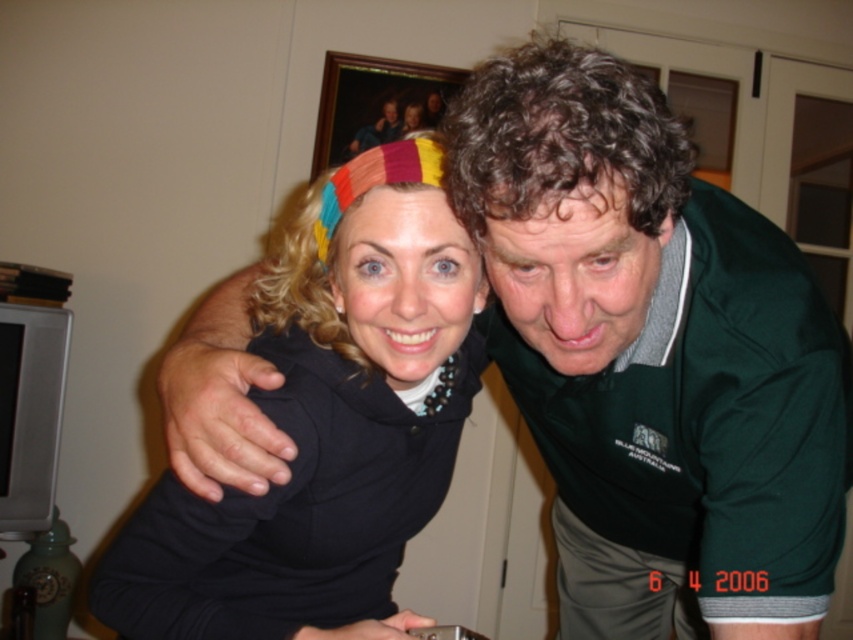
Between black matte headband at upper center and rainbow fabric headband at upper center, which one is positioned higher?

rainbow fabric headband at upper center

At what (x,y) coordinates should I click in order to perform the action: click on black matte headband at upper center. Please return your answer as a coordinate pair (x, y). Image resolution: width=853 pixels, height=640 pixels. Looking at the image, I should click on (322, 436).

In the scene shown: Measure the distance between black matte headband at upper center and camera.

A distance of 26.61 inches exists between black matte headband at upper center and camera.

You are a GUI agent. You are given a task and a screenshot of the screen. Output one action in this format:
    pyautogui.click(x=<x>, y=<y>)
    Task: Click on the black matte headband at upper center
    The image size is (853, 640).
    Given the screenshot: What is the action you would take?
    pyautogui.click(x=322, y=436)